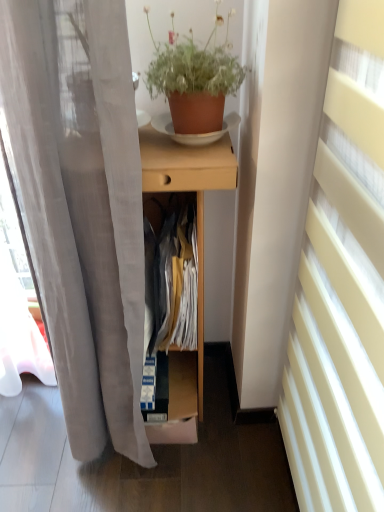
You are a GUI agent. You are given a task and a screenshot of the screen. Output one action in this format:
    pyautogui.click(x=<x>, y=<y>)
    Task: Click on the terracotta clay pot at upper center
    This screenshot has height=512, width=384.
    Given the screenshot: What is the action you would take?
    pyautogui.click(x=194, y=80)

The image size is (384, 512). Describe the element at coordinates (194, 80) in the screenshot. I see `terracotta clay pot at upper center` at that location.

Describe the element at coordinates (175, 400) in the screenshot. The image size is (384, 512). I see `cardboard box at center` at that location.

Locate an element on the screen. white sheer curtain at right is located at coordinates (342, 287).

Image resolution: width=384 pixels, height=512 pixels. I want to click on light wood desk at center, so click(x=198, y=257).

From a real-world perspective, between light wood desk at center and terracotta clay pot at upper center, who is vertically higher?

From a 3D spatial view, terracotta clay pot at upper center is above.

Does light wood desk at center have a larger size compared to terracotta clay pot at upper center?

Yes, light wood desk at center is bigger than terracotta clay pot at upper center.

Which object is wider, light wood desk at center or white sheer curtain at right?

With larger width is light wood desk at center.

How much distance is there between light wood desk at center and white sheer curtain at right?

light wood desk at center and white sheer curtain at right are 14.75 inches apart.

Is light wood desk at center aimed at white sheer curtain at right?

No, light wood desk at center is not facing towards white sheer curtain at right.

Looking at the image, does light wood desk at center seem bigger or smaller compared to white sheer curtain at right?

Considering their sizes, light wood desk at center takes up more space than white sheer curtain at right.

Does point (199, 194) come closer to viewer compared to point (382, 202)?

No, (199, 194) is behind (382, 202).

Is matte cardboard cabinet at center oriented away from white sheer curtain at right?

That's not correct — matte cardboard cabinet at center is not looking away from white sheer curtain at right.

Based on the photo, who is taller, matte cardboard cabinet at center or white sheer curtain at right?

white sheer curtain at right is taller.

Which object is positioned more to the right, matte cardboard cabinet at center or terracotta clay pot at upper center?

Positioned to the right is terracotta clay pot at upper center.

In the image, there is a matte cardboard cabinet at center. Identify the location of houseplant above it (from the image's perspective). The image size is (384, 512). (194, 80).

Can you confirm if matte cardboard cabinet at center is shorter than terracotta clay pot at upper center?

Incorrect, the height of matte cardboard cabinet at center does not fall short of that of terracotta clay pot at upper center.

Image resolution: width=384 pixels, height=512 pixels. In order to click on houseplant positioned vertically above the cardboard box at center (from a real-world perspective) in this screenshot , I will do `click(194, 80)`.

From a real-world perspective, is cardboard box at center physically below terracotta clay pot at upper center?

Yes, from a real-world perspective, cardboard box at center is below terracotta clay pot at upper center.

Does point (186, 440) come in front of point (171, 48)?

No, (186, 440) is behind (171, 48).

Can terracotta clay pot at upper center be found inside cardboard box at center?

Actually, terracotta clay pot at upper center is outside cardboard box at center.

Is cardboard box at center next to light wood desk at center?

They are not placed beside each other.

Is cardboard box at center facing towards light wood desk at center?

Yes, cardboard box at center is aimed at light wood desk at center.

Does point (167, 374) lie behind point (199, 380)?

That is False.

Considering the sizes of cardboard box at center and light wood desk at center in the image, is cardboard box at center bigger or smaller than light wood desk at center?

Considering their sizes, cardboard box at center takes up less space than light wood desk at center.

Is white sheer curtain at right surrounded by cardboard box at center?

That's incorrect, white sheer curtain at right is not inside cardboard box at center.

Is point (164, 409) closer or farther from the camera than point (334, 285)?

Point (164, 409) is farther from the camera than point (334, 285).

From a real-world perspective, which is physically below, cardboard box at center or white sheer curtain at right?

cardboard box at center, from a real-world perspective.

The width and height of the screenshot is (384, 512). I want to click on desk located below the terracotta clay pot at upper center (from the image's perspective), so click(198, 257).

Where is `curtain in front of the light wood desk at center`? This screenshot has height=512, width=384. curtain in front of the light wood desk at center is located at coordinates (342, 287).

Looking at this image, based on their spatial positions, is white sheer curtain at right or light wood desk at center further from cardboard box at center?

white sheer curtain at right is further to cardboard box at center.

When comparing their distances from white sheer curtain at right, does matte cardboard cabinet at center or terracotta clay pot at upper center seem further?

matte cardboard cabinet at center is further to white sheer curtain at right.

From the image, which object appears to be farther from matte cardboard cabinet at center, cardboard box at center or white sheer curtain at right?

white sheer curtain at right is further to matte cardboard cabinet at center.

Looking at the image, which one is located closer to terracotta clay pot at upper center, light wood desk at center or matte cardboard cabinet at center?

light wood desk at center.

When comparing their distances from terracotta clay pot at upper center, does cardboard box at center or light wood desk at center seem further?

cardboard box at center is positioned further to the anchor terracotta clay pot at upper center.

From the image, which object appears to be nearer to terracotta clay pot at upper center, cardboard box at center or matte cardboard cabinet at center?

Based on the image, matte cardboard cabinet at center appears to be nearer to terracotta clay pot at upper center.

Based on the photo, estimate the real-world distances between objects in this image. Which object is closer to terracotta clay pot at upper center, light wood desk at center or cardboard box at center?

light wood desk at center is positioned closer to the anchor terracotta clay pot at upper center.

Estimate the real-world distances between objects in this image. Which object is closer to white sheer curtain at right, terracotta clay pot at upper center or cardboard box at center?

Based on the image, terracotta clay pot at upper center appears to be nearer to white sheer curtain at right.

You are a GUI agent. You are given a task and a screenshot of the screen. Output one action in this format:
    pyautogui.click(x=<x>, y=<y>)
    Task: Click on the cabinet between light wood desk at center and cardboard box at center in the front-back direction
    
    Given the screenshot: What is the action you would take?
    coord(198,331)

Where is `cabinet between terracotta clay pot at upper center and cardboard box at center in the up-down direction`? This screenshot has height=512, width=384. cabinet between terracotta clay pot at upper center and cardboard box at center in the up-down direction is located at coordinates (198, 331).

Find the location of a particular element. The height and width of the screenshot is (512, 384). cabinet positioned between white sheer curtain at right and cardboard box at center from near to far is located at coordinates (198, 331).

Locate an element on the screen. desk between terracotta clay pot at upper center and white sheer curtain at right in the vertical direction is located at coordinates (198, 257).